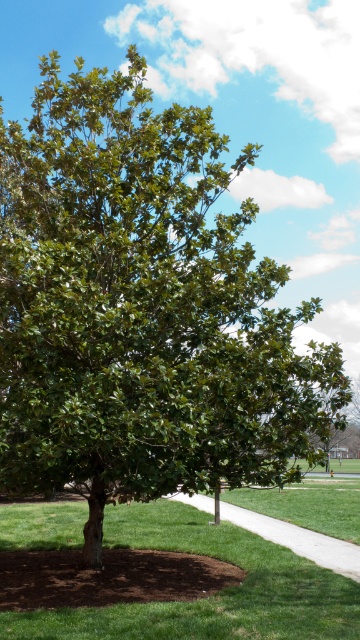
You are standing at the base of the tree and want to walk towards the paved pathway that curves around the tree. According to the image, where is the green grass at center in relation to the pathway?

The green grass at center is located at point (209, 596), which is near the base of the tree. The pathway curves around the tree, so the grass is likely between the tree and the pathway, making it necessary to walk through the grass to reach the pathway.

You are standing at the base of the tree and want to place two markers at the coordinates point (108, 529) and point (254, 522). Which marker will be closer to you when viewed from your current position?

Point (108, 529) is closer to the viewer than point (254, 522), so the marker at point (108, 529) will be closer to you.

You are standing at the camera position and want to walk to the point marked as point (x=272, y=618). The path is clear except for the tree and the circular soil patch. Can you reach the point without stepping on the tree or the soil patch?

The distance between you and point (x=272, y=618) is 5.83 meters. Since the path is clear except for the tree and soil patch, you can walk around them to reach the point without stepping on them.